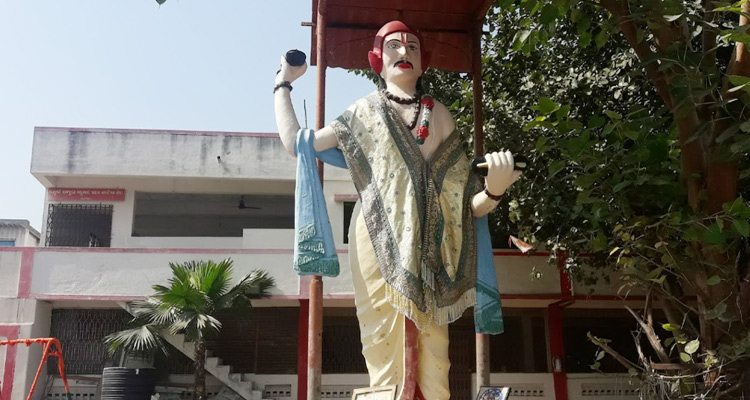
At what (x,y) coordinates should I click in order to perform the action: click on windows. Please return your answer as a coordinate pair (x, y). Looking at the image, I should click on (90, 221), (178, 207), (270, 202), (236, 327), (289, 327), (338, 324), (529, 322), (584, 322).